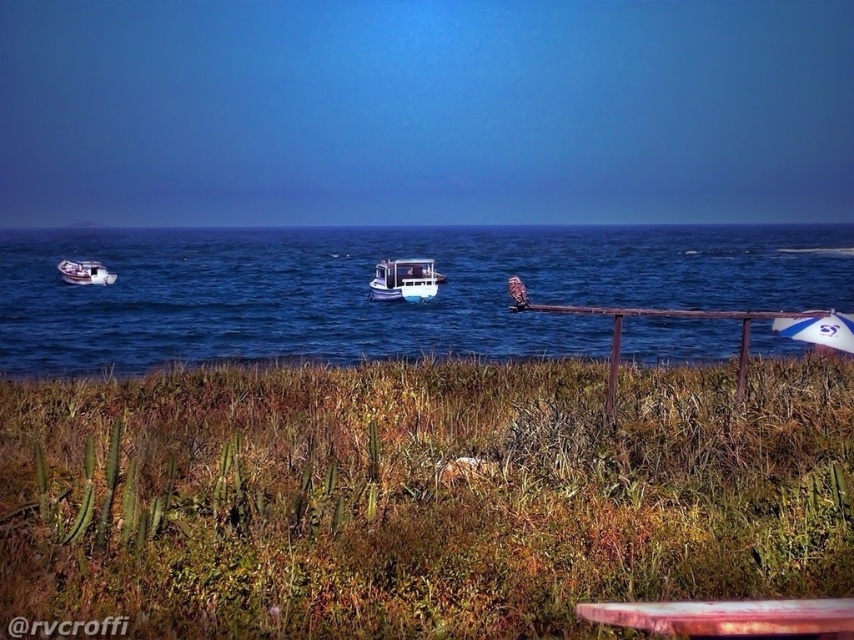
Question: Can you confirm if rusty metal picnic table at lower right is wider than white glossy umbrella at right?

Choices:
 (A) no
 (B) yes

Answer: (B)

Question: Which object is farther from the camera taking this photo?

Choices:
 (A) rusty metal picnic table at lower right
 (B) white glossy boat at center

Answer: (B)

Question: Among these objects, which one is farthest from the camera?

Choices:
 (A) blue water at center
 (B) white glossy umbrella at right

Answer: (B)

Question: Which point is farther from the camera taking this photo?

Choices:
 (A) (237, 252)
 (B) (734, 637)
 (C) (442, 381)

Answer: (A)

Question: Is green grassy at lower center below blue water at center?

Choices:
 (A) yes
 (B) no

Answer: (A)

Question: Is green grassy at lower center closer to the viewer compared to white glossy boat at center?

Choices:
 (A) yes
 (B) no

Answer: (A)